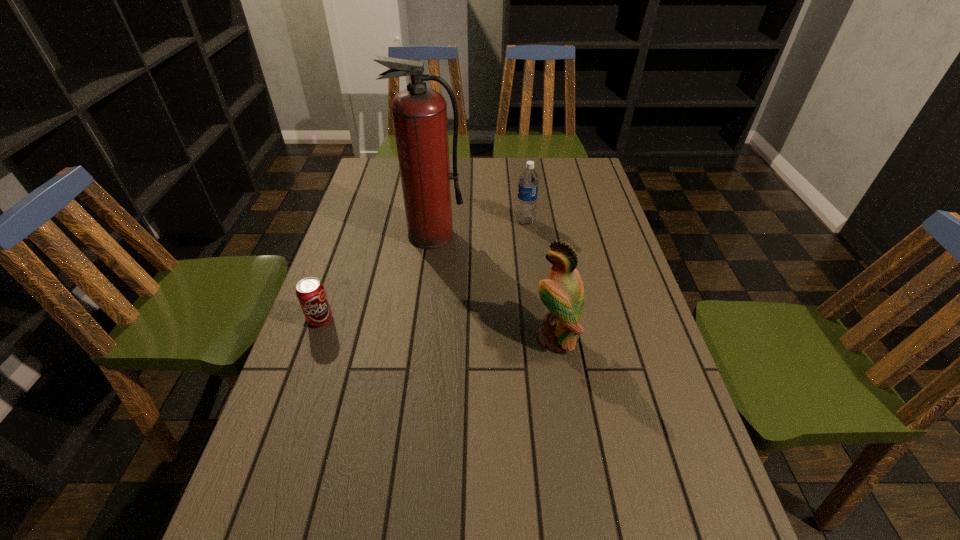
This screenshot has height=540, width=960. I want to click on unoccupied area between the second shortest object and the second tallest object, so click(540, 279).

The width and height of the screenshot is (960, 540). Identify the location of unoccupied position between the shortest object and the third tallest object. (423, 271).

At what (x,y) coordinates should I click in order to perform the action: click on the third closest object to the tallest object. Please return your answer as a coordinate pair (x, y). The width and height of the screenshot is (960, 540). Looking at the image, I should click on (562, 293).

Identify which object is the third nearest to the shortest object. Please provide its 2D coordinates. Your answer should be formatted as a tuple, i.e. [(x, y)], where the tuple contains the x and y coordinates of a point satisfying the conditions above.

[(528, 184)]